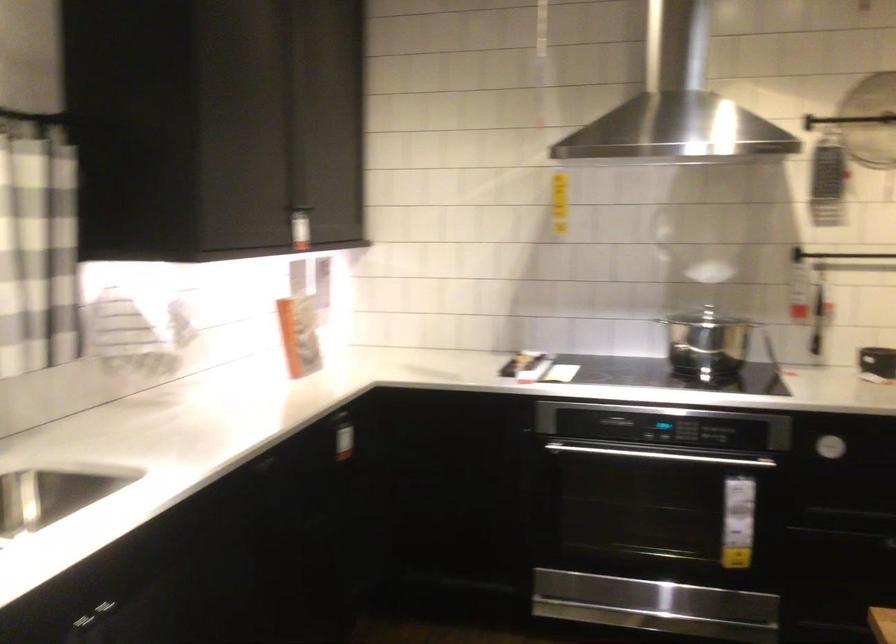
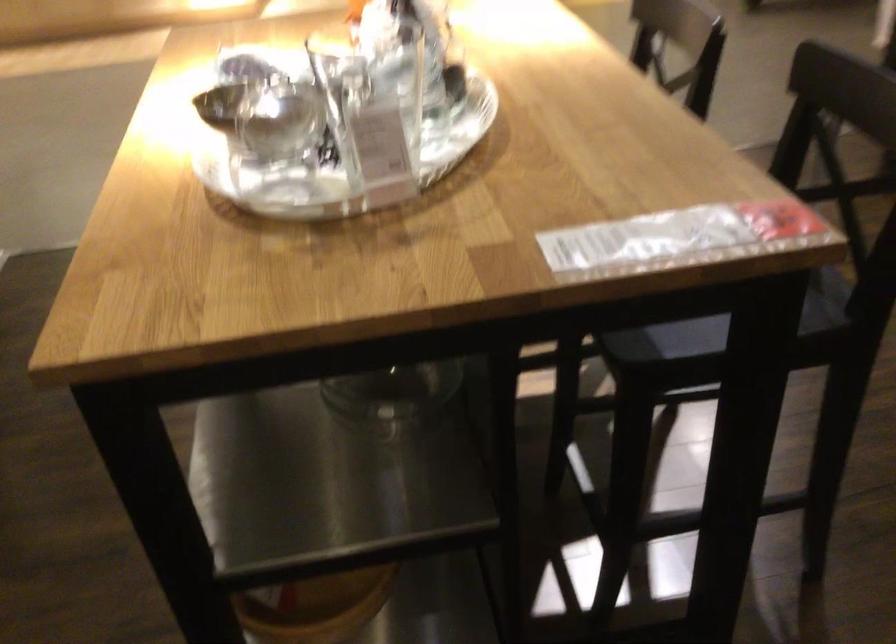
First-person continuous shooting, in which direction is the camera rotating?

The rotation direction of the camera is right-down.